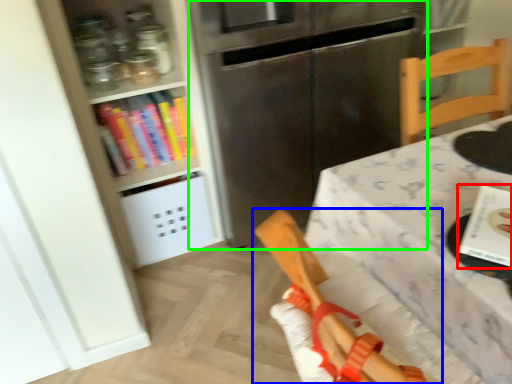
Question: Based on their relative distances, which object is nearer to book (highlighted by a red box)? Choose from chair (highlighted by a blue box) and fridge (highlighted by a green box).

Choices:
 (A) chair
 (B) fridge

Answer: (A)